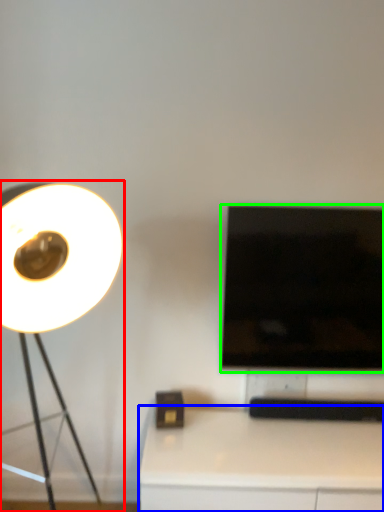
Question: Estimate the real-world distances between objects in this image. Which object is farther from lamp (highlighted by a red box), table (highlighted by a blue box) or television (highlighted by a green box)?

Choices:
 (A) table
 (B) television

Answer: (A)